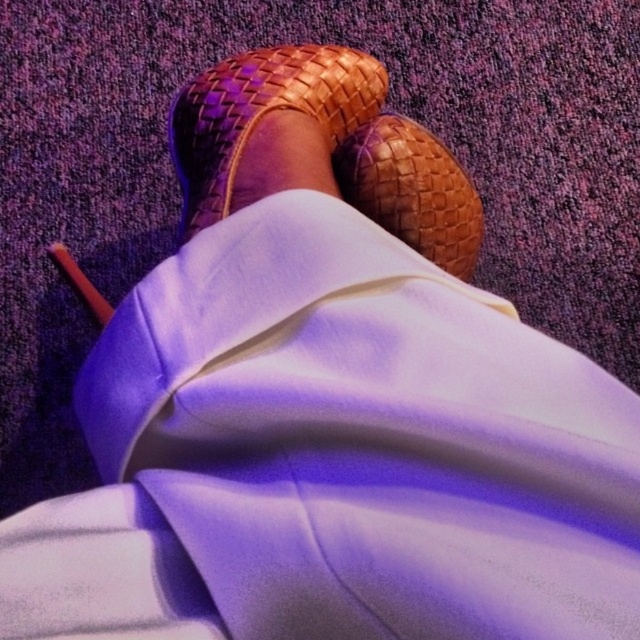
Question: Among these points, which one is nearest to the camera?

Choices:
 (A) (355, 186)
 (B) (332, 60)

Answer: (A)

Question: Does brown woven sandal at center have a lesser width compared to brown woven shoe at center?

Choices:
 (A) no
 (B) yes

Answer: (A)

Question: Which point is closer to the camera?

Choices:
 (A) brown woven sandal at center
 (B) brown woven shoe at center

Answer: (A)

Question: Which point is closer to the camera?

Choices:
 (A) click(x=374, y=64)
 (B) click(x=397, y=216)

Answer: (B)

Question: From the image, what is the correct spatial relationship of brown woven sandal at center in relation to brown woven shoe at center?

Choices:
 (A) right
 (B) left

Answer: (B)

Question: Where is brown woven sandal at center located in relation to brown woven shoe at center in the image?

Choices:
 (A) above
 (B) below

Answer: (A)